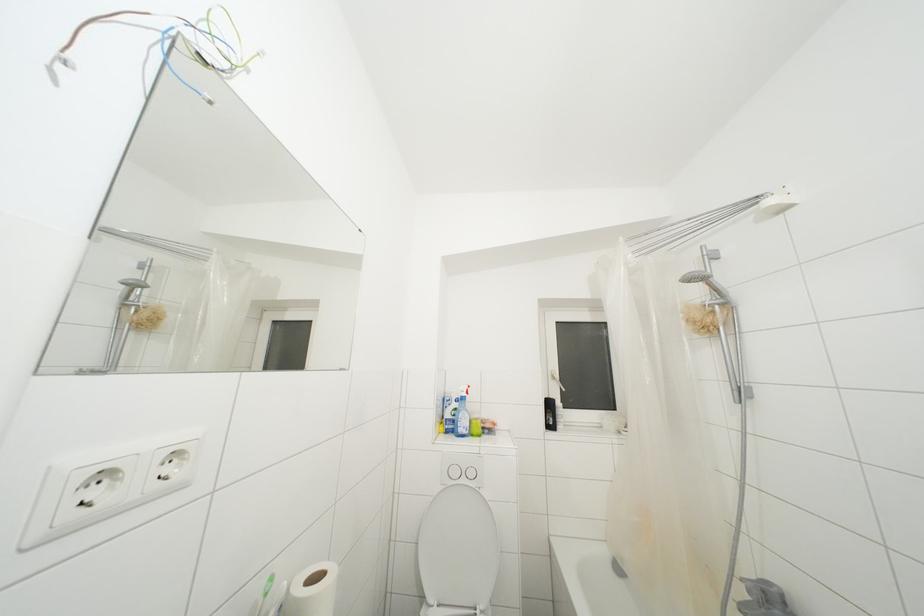
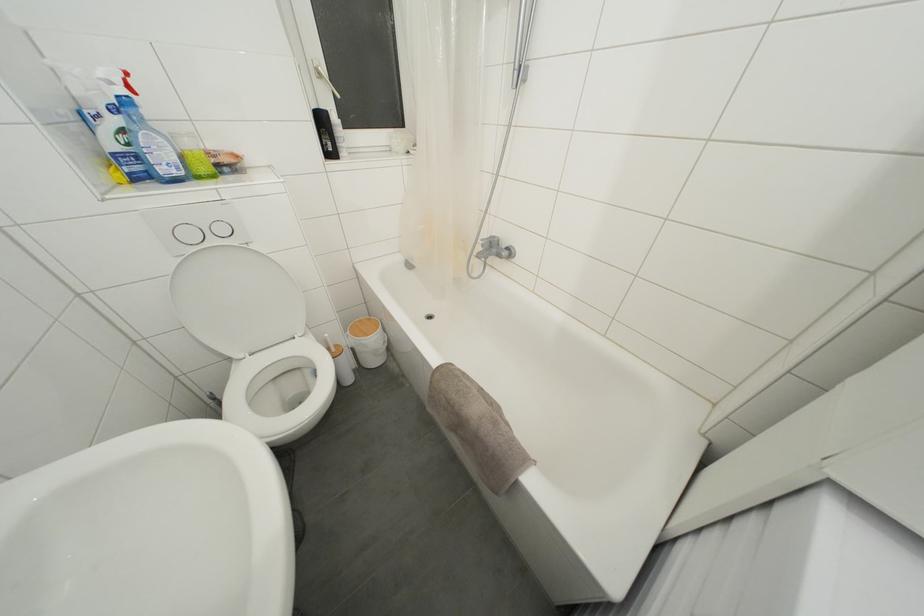
Locate, in the second image, the point that corresponds to [476,477] in the first image.

(226, 235)